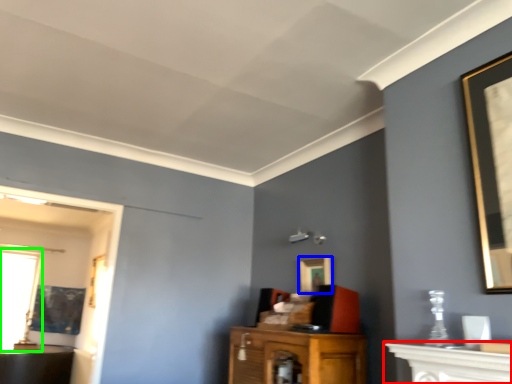
Question: Which object is the farthest from vanity (highlighted by a red box)? Choose among these: picture frame (highlighted by a blue box) or window (highlighted by a green box).

Choices:
 (A) picture frame
 (B) window

Answer: (B)